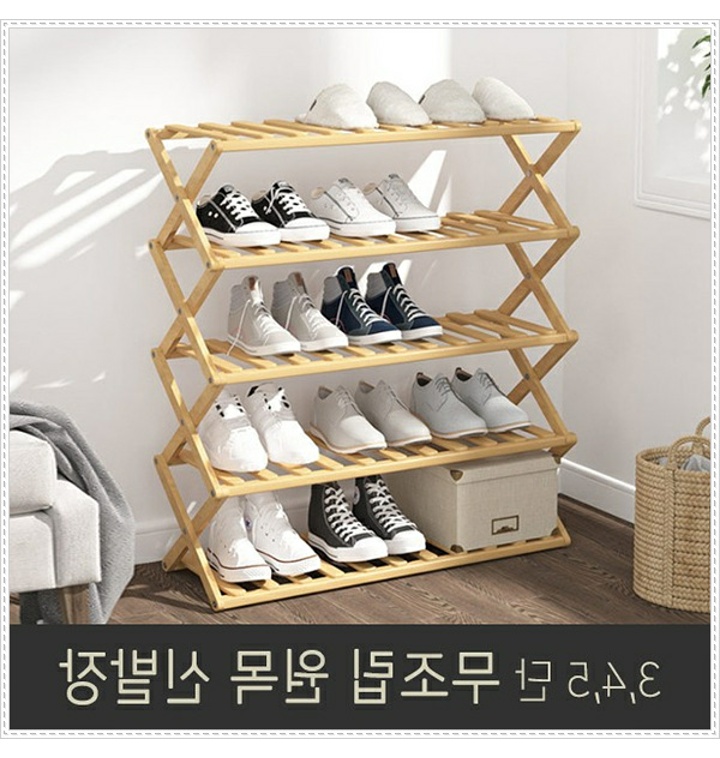
Find the location of `slippers`. slippers is located at coordinates (345, 118), (402, 111), (454, 111), (513, 110).